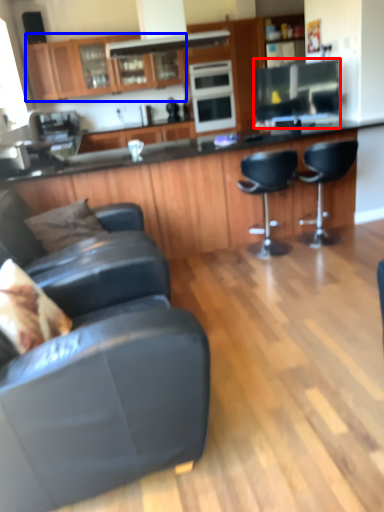
Question: Which object is closer to the camera taking this photo, appliance (highlighted by a red box) or cabinetry (highlighted by a blue box)?

Choices:
 (A) appliance
 (B) cabinetry

Answer: (A)